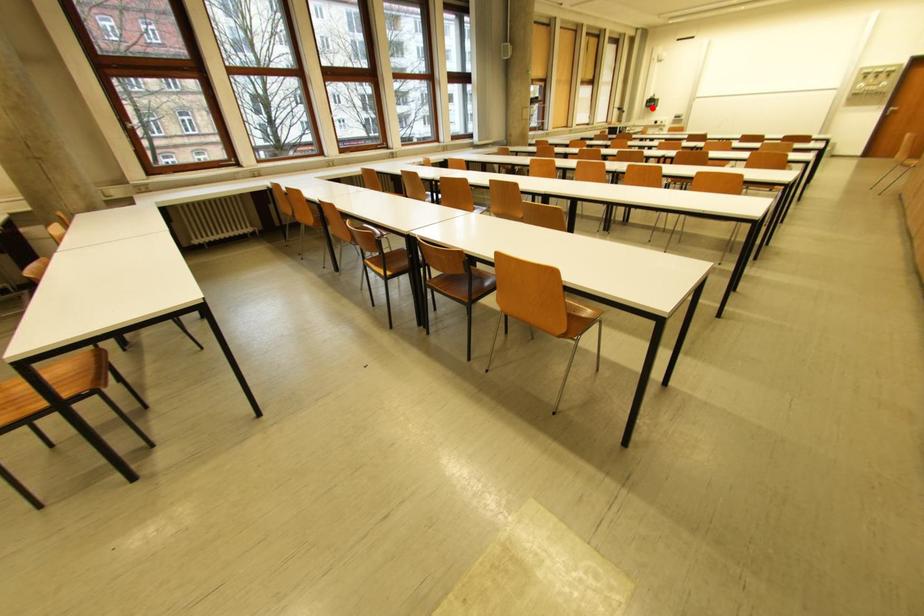
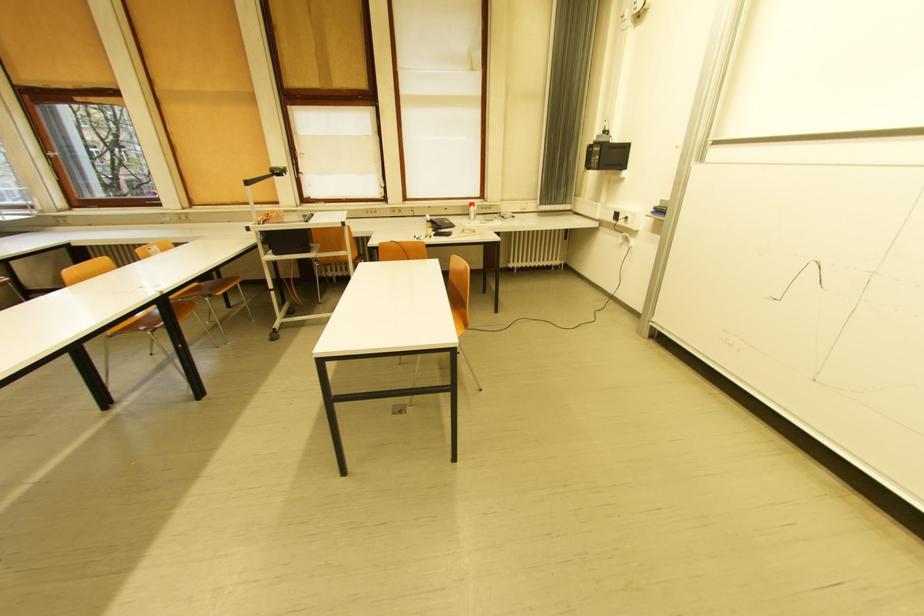
Locate, in the second image, the point that corresponds to the highlighted location in the first image.

(592, 168)